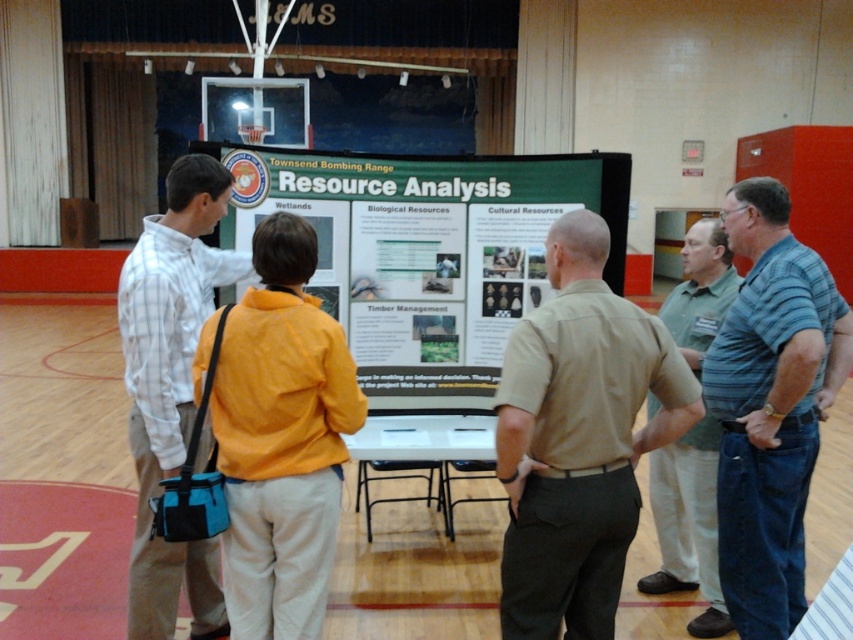
How far apart are light brown plaid shirt at center and khaki uniform shirt at center?

light brown plaid shirt at center is 1.79 meters away from khaki uniform shirt at center.

Is point (184, 256) positioned in front of point (722, 612)?

Yes, point (184, 256) is closer to viewer.

Does point (131, 371) come in front of point (706, 588)?

That is True.

Identify the location of light brown plaid shirt at center. (171, 387).

Does green matte poster at center appear under khaki pants at center?

Incorrect, green matte poster at center is not positioned below khaki pants at center.

Between green matte poster at center and khaki pants at center, which one appears on the right side from the viewer's perspective?

green matte poster at center is more to the right.

Is point (495, 326) positioned behind point (289, 304)?

Yes, point (495, 326) is behind point (289, 304).

At what (x,y) coordinates should I click in order to perform the action: click on green matte poster at center. Please return your answer as a coordinate pair (x, y). Looking at the image, I should click on (434, 256).

Looking at this image, can you confirm if tan uniform at center is positioned above khaki pants at center?

Correct, tan uniform at center is located above khaki pants at center.

Is tan uniform at center positioned in front of khaki pants at center?

Yes, tan uniform at center is closer to the viewer.

Identify the location of tan uniform at center. (578, 438).